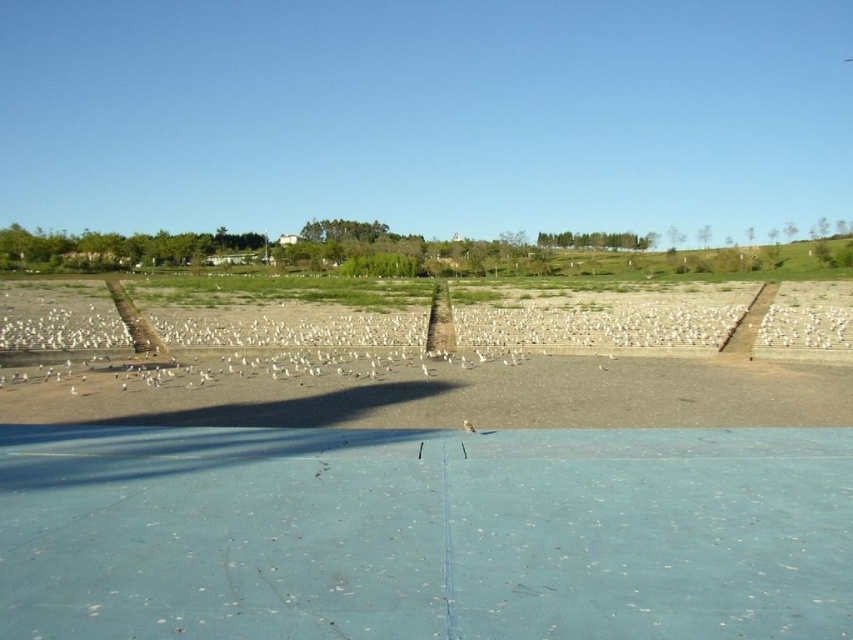
You are standing on the flat light blue surface in the foreground of the scene. You want to pick up the brown feathered bird at center. Which direction should you move to reach it first, considering the brown sandy dirt at center is in your way?

The brown sandy dirt at center is located above the brown feathered bird at center, so you should move downward from the brown sandy dirt at center to reach the brown feathered bird at center.

You are a photographer trying to capture the entire scene in one shot. Given that your camera can only focus on objects larger than 1 meter in size, will the brown sandy dirt at center and the brown feathered bird at center both be in focus?

The brown sandy dirt at center is larger in size than the brown feathered bird at center. Since the sandy dirt is larger than 1 meter, it will be in focus. However, the bird may be smaller than 1 meter and thus might not be in focus.